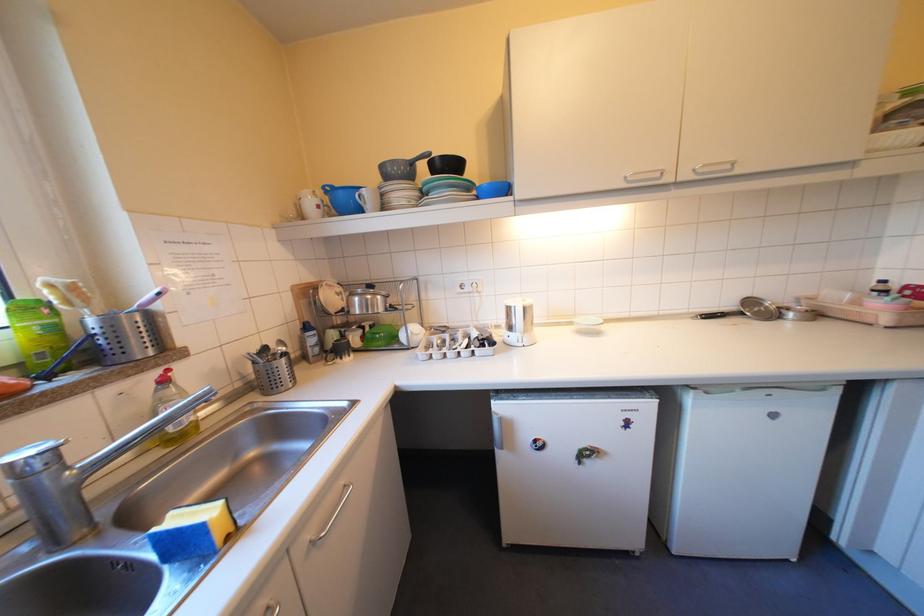
Image resolution: width=924 pixels, height=616 pixels. Find the location of `blue mug handle`. blue mug handle is located at coordinates 369,199.